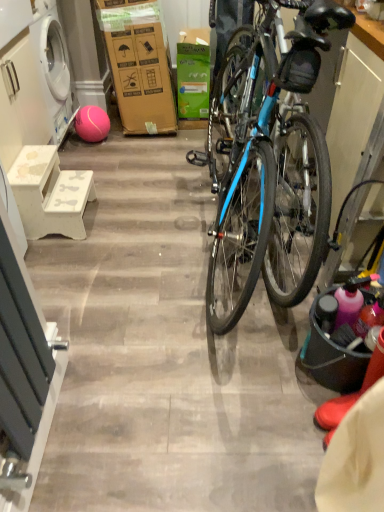
Question: Is white matte stool at left wider than pink rubber ball at lower left?

Choices:
 (A) yes
 (B) no

Answer: (A)

Question: Is white matte stool at left positioned behind pink rubber ball at lower left?

Choices:
 (A) no
 (B) yes

Answer: (A)

Question: From a real-world perspective, is white matte stool at left beneath pink rubber ball at lower left?

Choices:
 (A) no
 (B) yes

Answer: (A)

Question: From the image's perspective, does white matte stool at left appear higher than pink rubber ball at lower left?

Choices:
 (A) yes
 (B) no

Answer: (B)

Question: Does white matte stool at left appear on the right side of pink rubber ball at lower left?

Choices:
 (A) no
 (B) yes

Answer: (A)

Question: From a real-world perspective, does white matte stool at left stand above pink rubber ball at lower left?

Choices:
 (A) yes
 (B) no

Answer: (A)

Question: Considering the relative positions of matte black bucket at right and green cardboard box at center in the image provided, is matte black bucket at right to the left of green cardboard box at center from the viewer's perspective?

Choices:
 (A) yes
 (B) no

Answer: (B)

Question: From the image's perspective, would you say matte black bucket at right is positioned over green cardboard box at center?

Choices:
 (A) no
 (B) yes

Answer: (A)

Question: From the image's perspective, would you say matte black bucket at right is shown under green cardboard box at center?

Choices:
 (A) yes
 (B) no

Answer: (A)

Question: Is green cardboard box at center a part of matte black bucket at right?

Choices:
 (A) no
 (B) yes

Answer: (A)

Question: Is matte black bucket at right positioned in front of green cardboard box at center?

Choices:
 (A) no
 (B) yes

Answer: (B)

Question: Is matte black bucket at right aimed at green cardboard box at center?

Choices:
 (A) yes
 (B) no

Answer: (B)

Question: Does white matte stool at left have a larger size compared to matte black bucket at right?

Choices:
 (A) no
 (B) yes

Answer: (B)